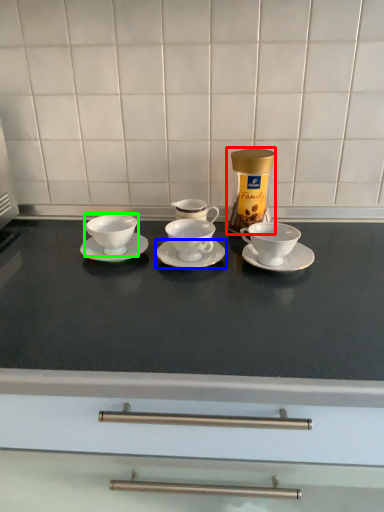
Question: Based on their relative distances, which object is farther from appliance (highlighted by a red box)? Choose from saucer (highlighted by a blue box) and coffee cup (highlighted by a green box).

Choices:
 (A) saucer
 (B) coffee cup

Answer: (B)